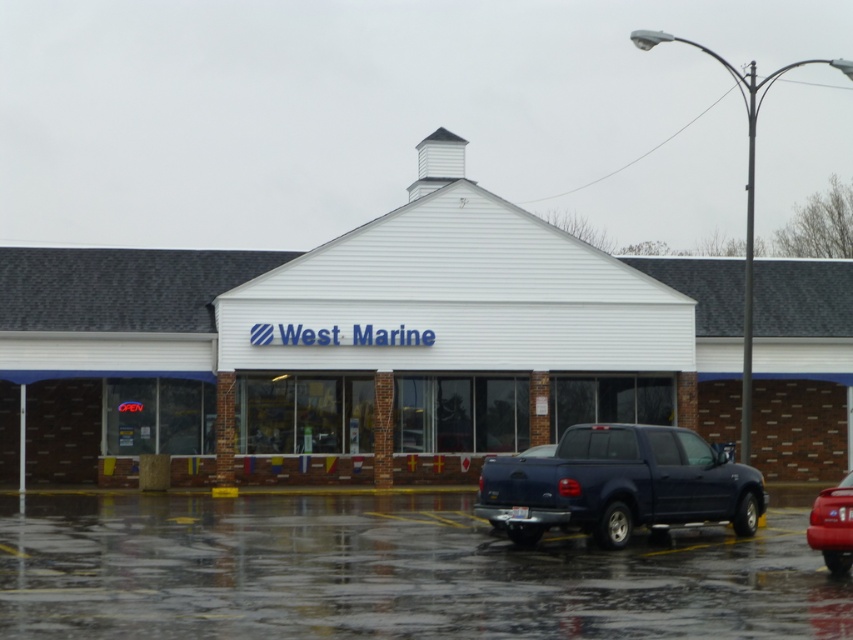
Question: Does dark blue matte truck at lower center appear on the right side of shiny red car at lower right?

Choices:
 (A) no
 (B) yes

Answer: (A)

Question: Can you confirm if wet asphalt at lower center is positioned to the left of shiny red car at lower right?

Choices:
 (A) yes
 (B) no

Answer: (A)

Question: Can you confirm if wet asphalt at lower center is positioned to the right of shiny red car at lower right?

Choices:
 (A) yes
 (B) no

Answer: (B)

Question: Among these points, which one is nearest to the camera?

Choices:
 (A) (219, 538)
 (B) (595, 512)
 (C) (822, 524)

Answer: (C)

Question: Which of these objects is positioned farthest from the dark blue matte truck at lower center?

Choices:
 (A) wet asphalt at lower center
 (B) shiny red car at lower right

Answer: (B)

Question: Among these objects, which one is farthest from the camera?

Choices:
 (A) dark blue matte truck at lower center
 (B) shiny red car at lower right

Answer: (A)